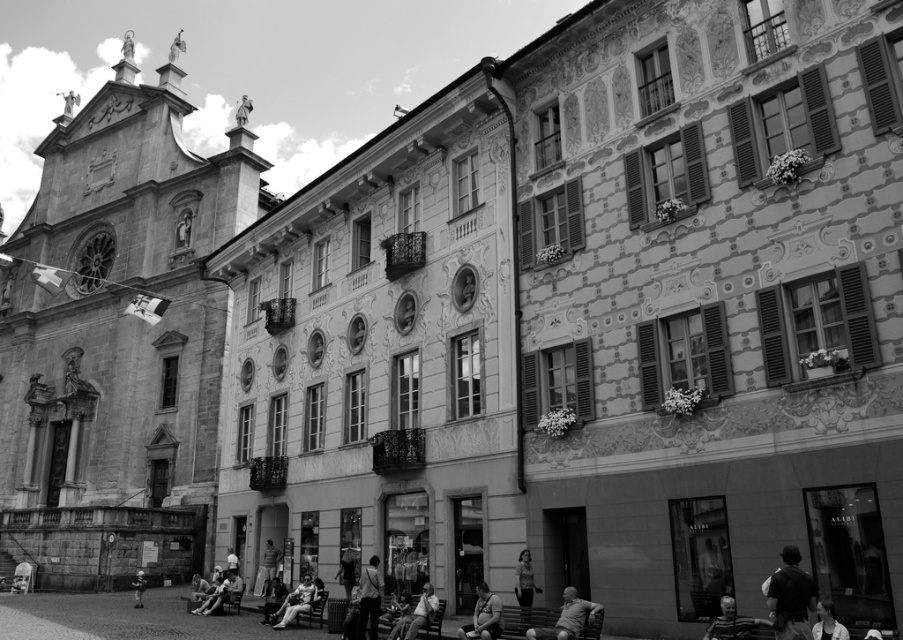
You are standing in the town square and want to walk from the point at coordinates point [361,602] to the point at coordinates point [388,637]. According to the image, will you be moving towards the church or away from it?

Since point [361,602] is in front of point [388,637], moving from point [361,602] to point [388,637] means you are moving away from the church.

Looking at this image, you are a photographer standing in the town square and notice two leather jackets hanging on a rack at the center. Which jacket is closer to you, the light brown leather jacket at center or the smooth leather jacket at center?

The light brown leather jacket at center is closer to you since it is further to the viewer than the smooth leather jacket at center.